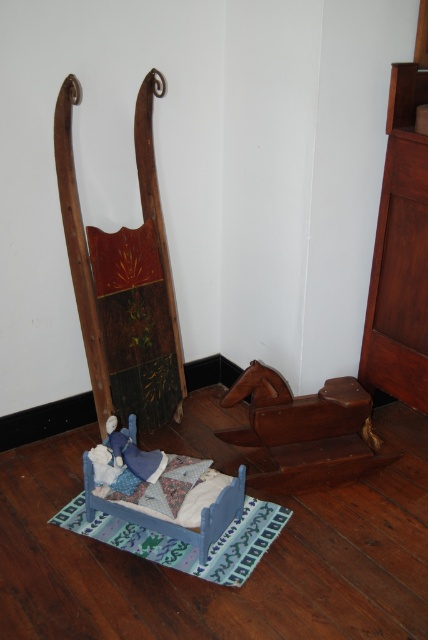
Question: Does mahogany wood dresser at right appear on the left side of blue fabric mat at center?

Choices:
 (A) yes
 (B) no

Answer: (B)

Question: Which of the following is the farthest from the observer?

Choices:
 (A) blue painted wood bed at lower center
 (B) wooden rocking horse at lower right

Answer: (B)

Question: Is wooden rocking horse at lower right in front of quilted fabric pillow at center?

Choices:
 (A) no
 (B) yes

Answer: (A)

Question: Can you confirm if blue fabric mat at center is positioned above quilted fabric pillow at center?

Choices:
 (A) no
 (B) yes

Answer: (A)

Question: Which point is farther from the camera taking this photo?

Choices:
 (A) (401, 188)
 (B) (155, 561)
 (C) (359, 465)

Answer: (C)

Question: Estimate the real-world distances between objects in this image. Which object is farther from the mahogany wood dresser at right?

Choices:
 (A) quilted fabric pillow at center
 (B) blue painted wood bed at lower center
 (C) wooden rocking horse at lower right
 (D) blue fabric mat at center

Answer: (D)